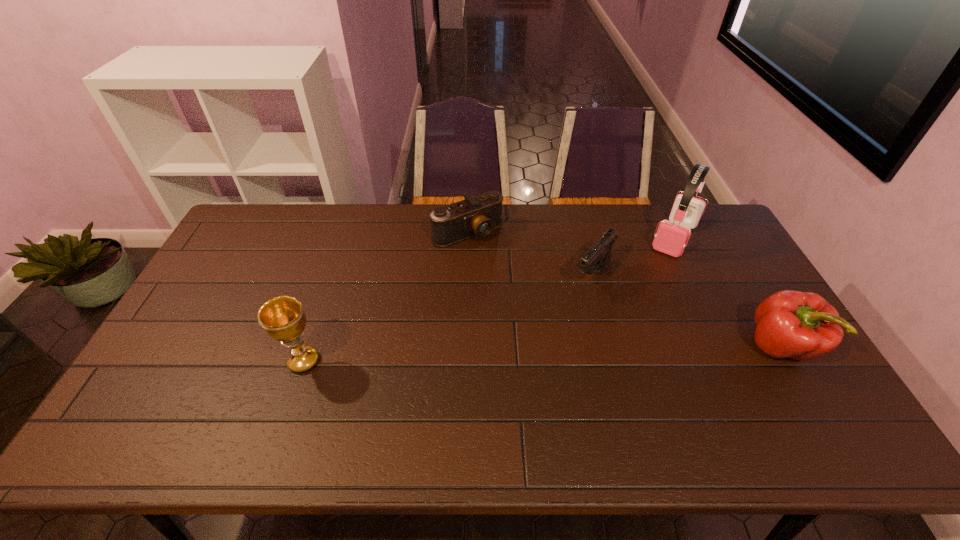
Image resolution: width=960 pixels, height=540 pixels. I want to click on free space that satisfies the following two spatial constraints: 1. on the back side of the chalice; 2. on the left side of the earphone, so click(345, 238).

Find the location of a particular element. The height and width of the screenshot is (540, 960). blank space that satisfies the following two spatial constraints: 1. on the front side of the shortest object; 2. on the right side of the tallest object is located at coordinates (468, 238).